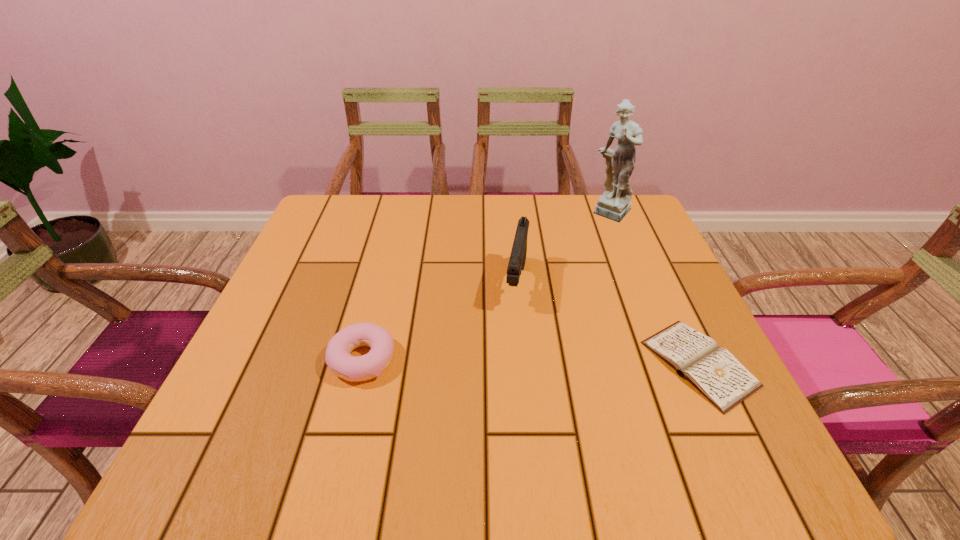
Find the location of a particular element. The image size is (960, 540). the second closest object to the doughnut is located at coordinates (714, 371).

Where is `free space that satisfies the following two spatial constraints: 1. on the back side of the second tallest object; 2. on the right side of the second shortest object`? This screenshot has width=960, height=540. free space that satisfies the following two spatial constraints: 1. on the back side of the second tallest object; 2. on the right side of the second shortest object is located at coordinates (382, 284).

Identify the location of blank space that satisfies the following two spatial constraints: 1. on the front side of the third object from right to left; 2. on the right side of the diary. (523, 363).

You are a GUI agent. You are given a task and a screenshot of the screen. Output one action in this format:
    pyautogui.click(x=<x>, y=<y>)
    Task: Click on the free space that satisfies the following two spatial constraints: 1. on the back side of the farthest object; 2. on the left side of the third tallest object
    The image size is (960, 540).
    Given the screenshot: What is the action you would take?
    pyautogui.click(x=400, y=213)

Find the location of a particular element. free space that satisfies the following two spatial constraints: 1. on the back side of the farthest object; 2. on the left side of the doughnut is located at coordinates (400, 213).